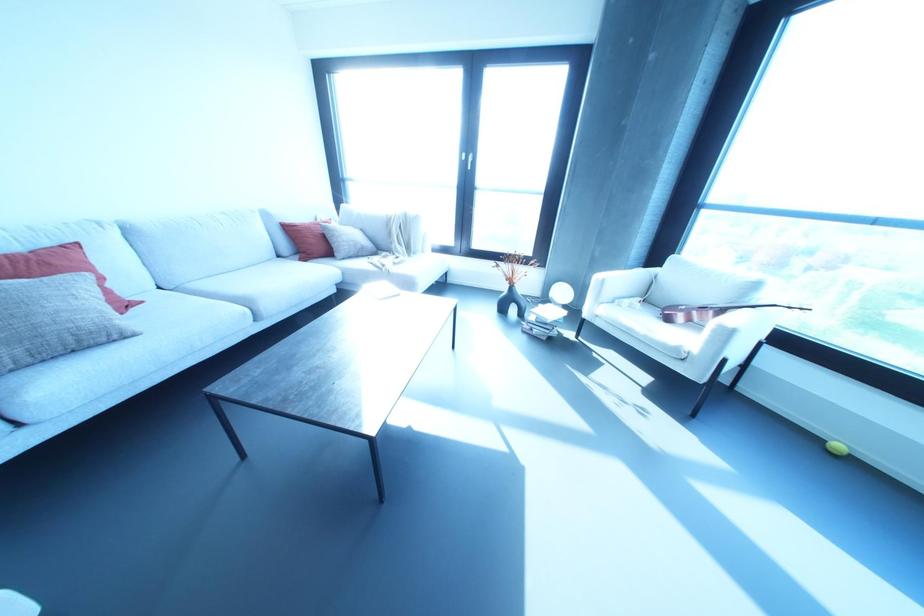
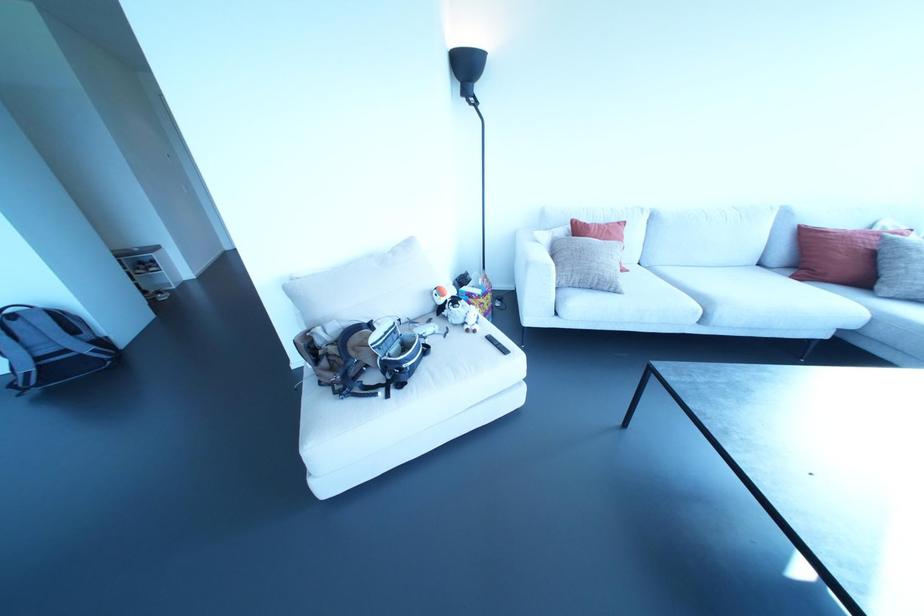
Locate, in the second image, the point that corresponds to point 134,334 in the first image.

(618, 293)